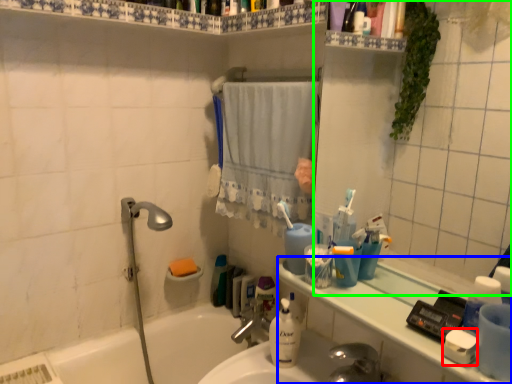
Question: Which object is positioned closest to soap (highlighted by a red box)? Select from counter top (highlighted by a blue box) and mirror (highlighted by a green box).

Choices:
 (A) counter top
 (B) mirror

Answer: (A)